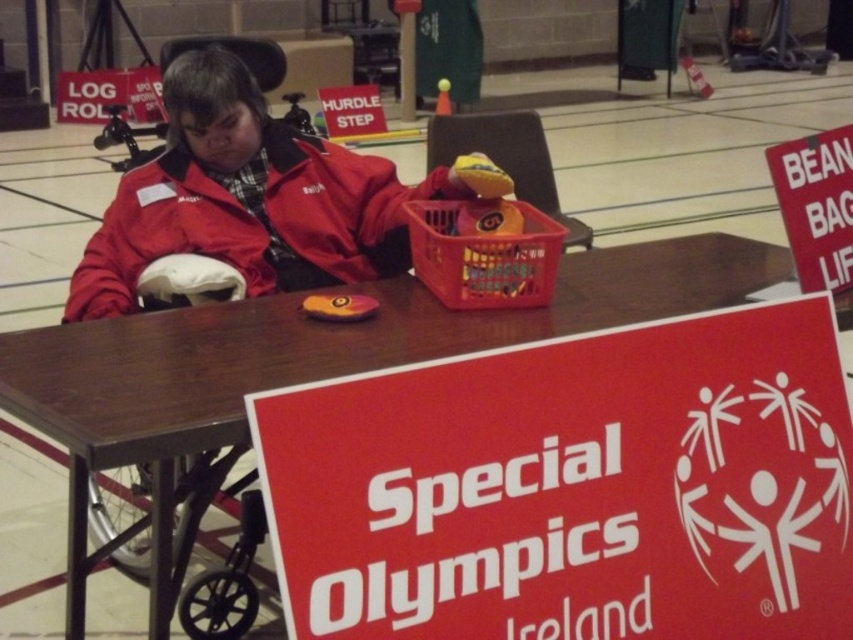
Question: Which point appears farthest from the camera in this image?

Choices:
 (A) (529, 276)
 (B) (683, 272)

Answer: (B)

Question: Which of the following is the closest to the observer?

Choices:
 (A) (462, 253)
 (B) (698, 253)

Answer: (A)

Question: Does brown wooden table at center appear under plastic basket at center?

Choices:
 (A) yes
 (B) no

Answer: (A)

Question: Is brown wooden table at center in front of plastic basket at center?

Choices:
 (A) no
 (B) yes

Answer: (B)

Question: Does brown wooden table at center appear on the right side of plastic basket at center?

Choices:
 (A) yes
 (B) no

Answer: (A)